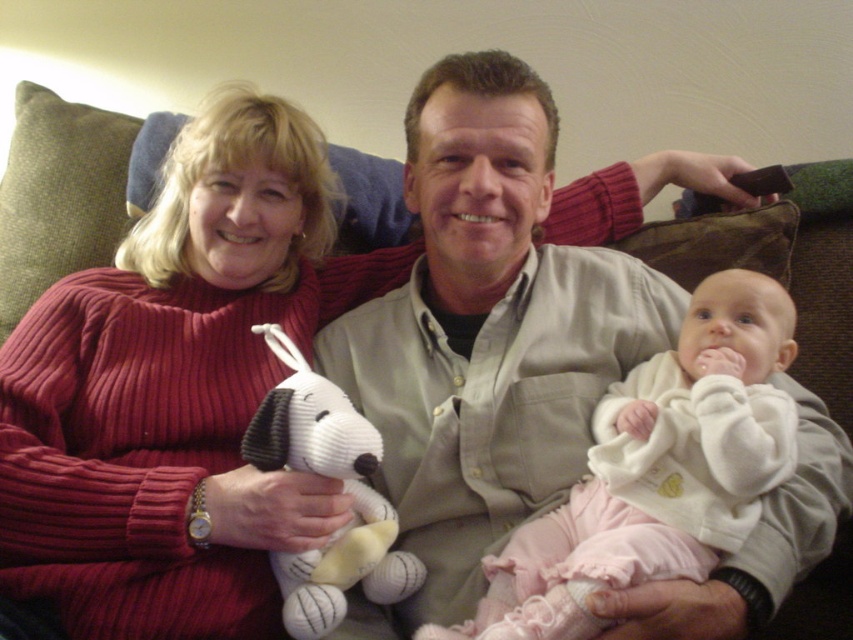
In the scene where a woman, man, and baby are on a couch, you need to place a small gift under the matte khaki shirt at center and the white knitted dog at center. Which object should you place the gift under to ensure it is visible from above?

The gift should be placed under the white knitted dog at center because the matte khaki shirt at center is above it, so placing the gift under the white knitted dog at center would keep it visible from above.

You are a photographer setting up a shoot in the living room. You need to position a matte khaki shirt and a white knitted dog so that the shirt is in front of the dog. Based on the scene description, is the current arrangement of the matte khaki shirt at center and the white knitted dog at center already meeting your requirement?

Yes, the current arrangement already meets your requirement because the matte khaki shirt at center is in front of the white knitted dog at center as described.

You are a photographer setting up for a family portrait. You notice the white fleece jacket at center and the white knitted dog at center in the scene. To ensure both items are clearly visible in the photo, which one should you focus on first, the one closer to the camera or the one further away?

The white fleece jacket at center is located above the white knitted dog at center, so focusing on the one closer to the camera would ensure both are in focus since the jacket is above and thus likely closer.